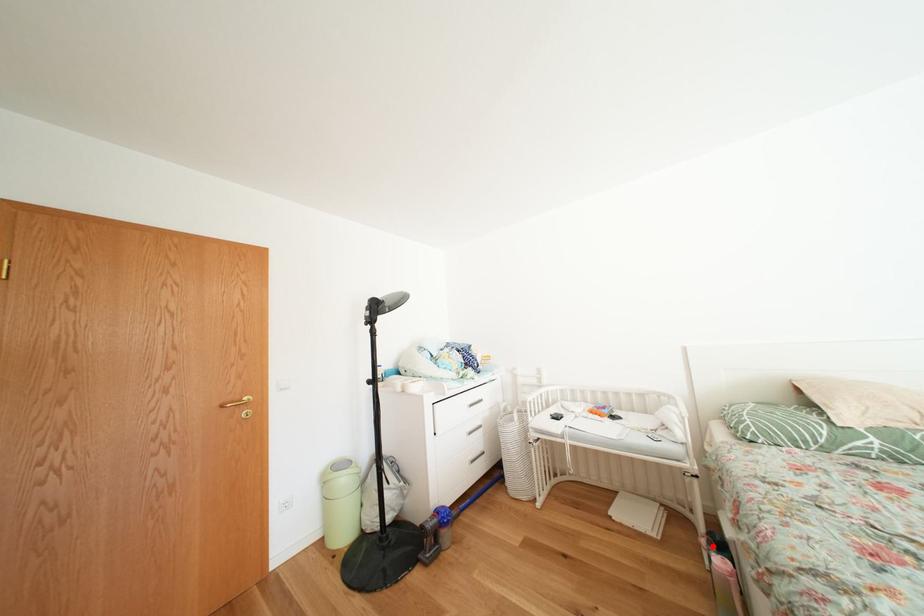
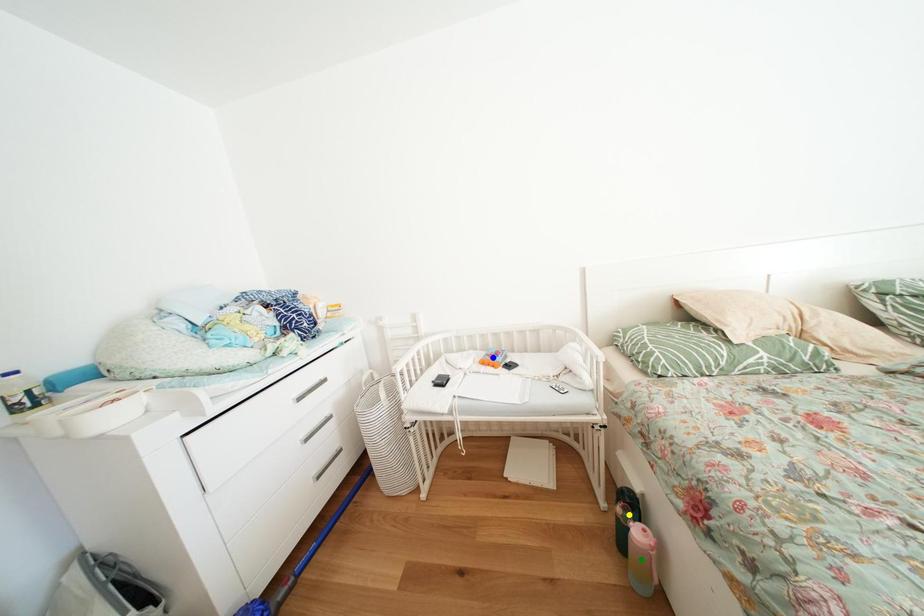
Question: I am providing you with two images of the same scene from different viewpoints. A red point is marked on the first image. You are given multiple points on the second image. In image 2, which mark is for the same physical point as the one in image 1?

Choices:
 (A) green point
 (B) yellow point
 (C) blue point

Answer: (B)